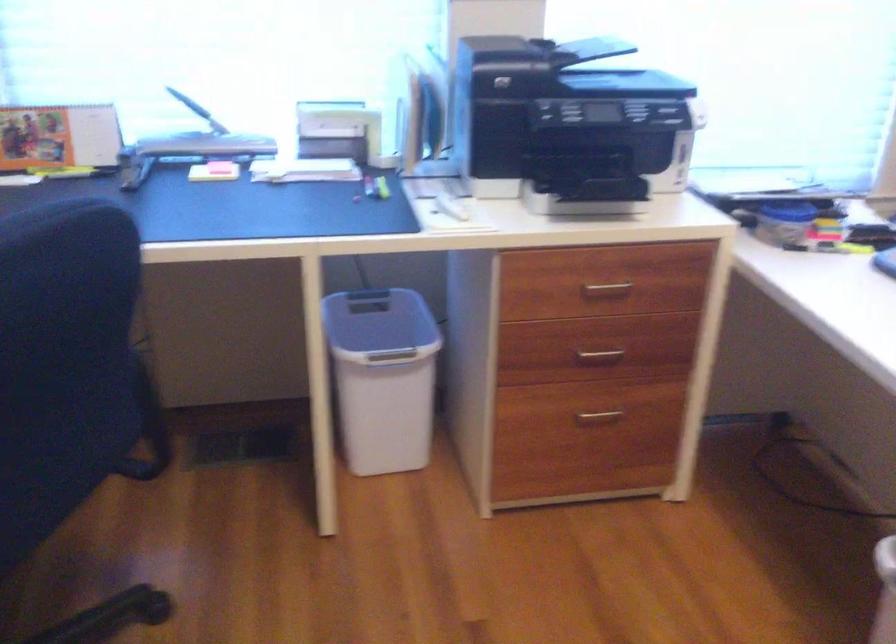
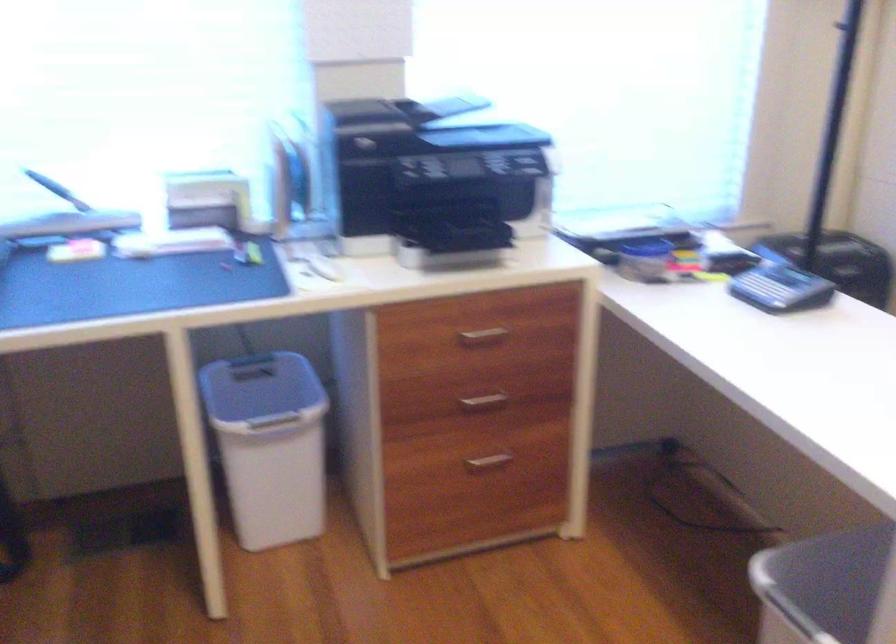
The point at (598, 353) is marked in the first image. Where is the corresponding point in the second image?

(484, 401)